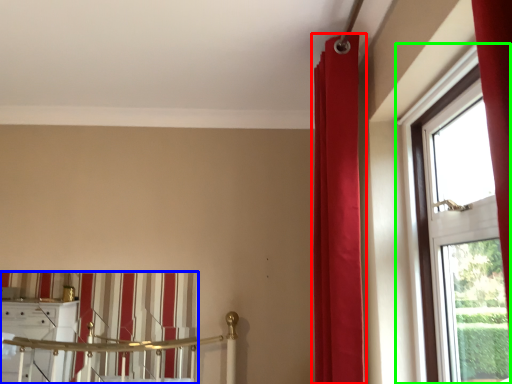
Question: Based on their relative distances, which object is nearer to curtain (highlighted by a red box)? Choose from curtain (highlighted by a blue box) and window (highlighted by a green box).

Choices:
 (A) curtain
 (B) window

Answer: (B)